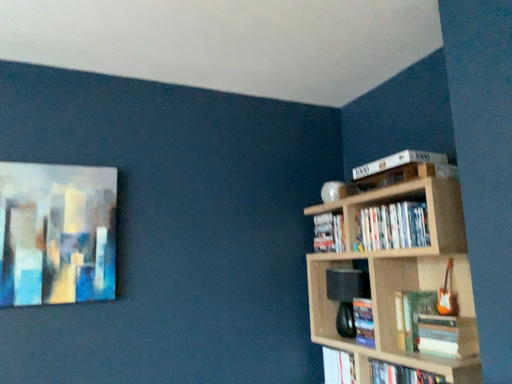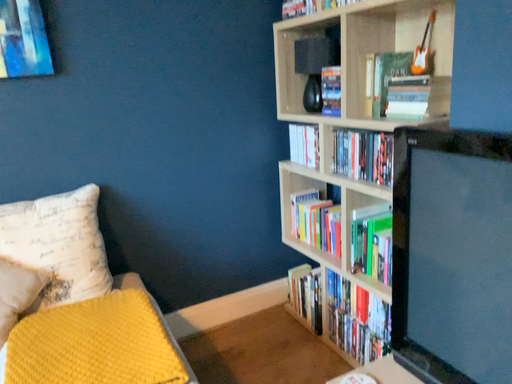
Question: How did the camera likely rotate when shooting the video?

Choices:
 (A) rotated upward
 (B) rotated downward

Answer: (B)